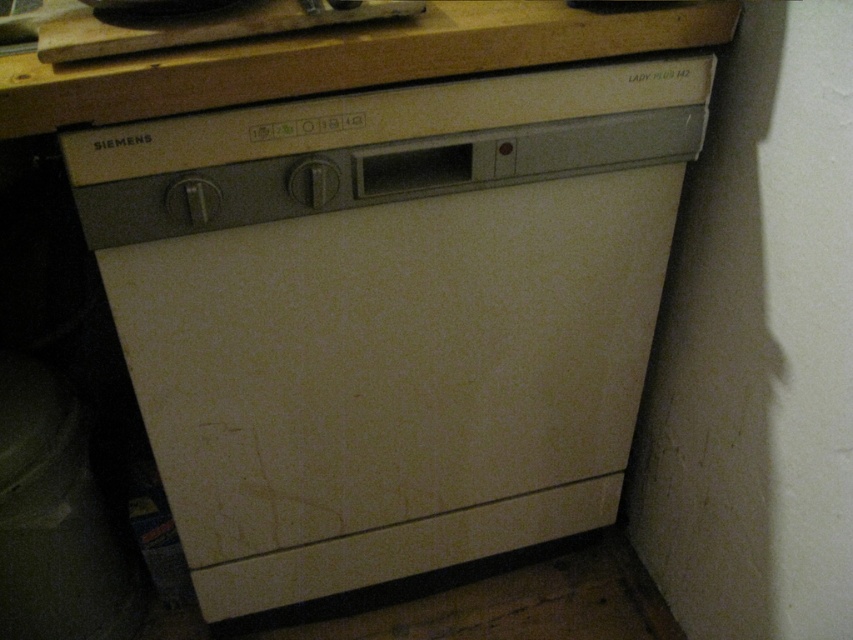
Question: In this image, where is beige matte dishwasher at center located relative to wooden at upper center?

Choices:
 (A) right
 (B) left

Answer: (A)

Question: Is beige matte dishwasher at center below wooden at upper center?

Choices:
 (A) no
 (B) yes

Answer: (B)

Question: Is beige matte dishwasher at center wider than wooden at upper center?

Choices:
 (A) no
 (B) yes

Answer: (A)